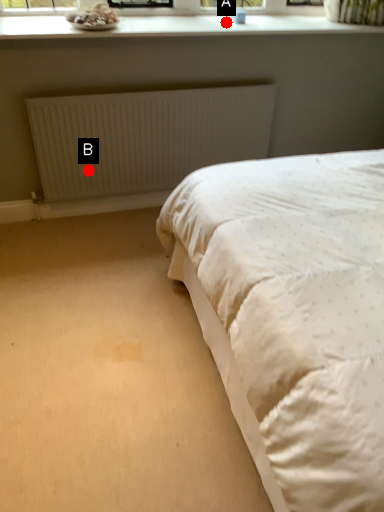
Question: Two points are circled on the image, labeled by A and B beside each circle. Which point appears farthest from the camera in this image?

Choices:
 (A) A is further
 (B) B is further

Answer: (B)